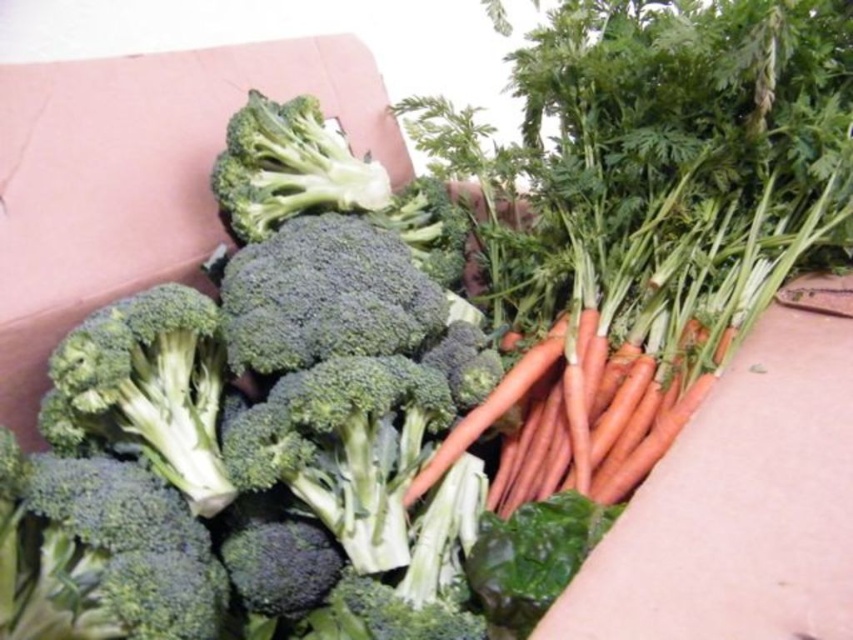
Does green matte broccoli at center appear on the left side of green matte broccoli at left?

In fact, green matte broccoli at center is to the right of green matte broccoli at left.

At what (x,y) coordinates should I click in order to perform the action: click on green matte broccoli at center. Please return your answer as a coordinate pair (x, y). Looking at the image, I should click on (260, 420).

The width and height of the screenshot is (853, 640). What do you see at coordinates (148, 387) in the screenshot? I see `green matte broccoli at left` at bounding box center [148, 387].

Measure the distance between green matte broccoli at left and orange smooth carrot at center.

green matte broccoli at left is 11.61 inches from orange smooth carrot at center.

Is point (151, 364) closer to viewer compared to point (463, 417)?

Yes, it is in front of point (463, 417).

Find the location of a particular element. The image size is (853, 640). green matte broccoli at left is located at coordinates (148, 387).

Does green matte broccoli at center appear under green fresh broccoli at upper center?

Correct, green matte broccoli at center is located below green fresh broccoli at upper center.

Is point (44, 618) farther from camera compared to point (384, 179)?

No, (44, 618) is in front of (384, 179).

The height and width of the screenshot is (640, 853). I want to click on green matte broccoli at center, so click(260, 420).